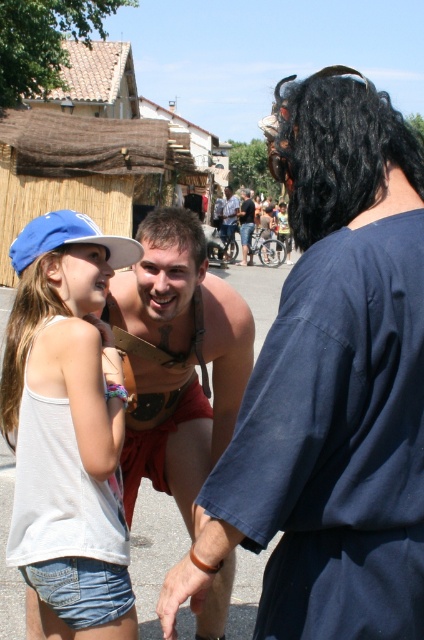
Does shiny black shirt at center have a greater width compared to shiny gold armor at center?

No, shiny black shirt at center is not wider than shiny gold armor at center.

The height and width of the screenshot is (640, 424). I want to click on shiny black shirt at center, so click(x=245, y=225).

At what (x,y) coordinates should I click in order to perform the action: click on shiny black shirt at center. Please return your answer as a coordinate pair (x, y). The height and width of the screenshot is (640, 424). Looking at the image, I should click on (245, 225).

Where is `shiny black shirt at center`? This screenshot has width=424, height=640. shiny black shirt at center is located at coordinates (245, 225).

Which is behind, point (161, 396) or point (78, 211)?

The point (78, 211) is more distant.

Is shiny leather belt at center wider than blue fabric baseball cap at upper left?

Yes.

Is point (186, 298) positioned behind point (78, 237)?

Yes, it is behind point (78, 237).

Where is `shiny leather belt at center`? The image size is (424, 640). shiny leather belt at center is located at coordinates (176, 358).

Which is below, shiny metallic belt at lower left or white denim shorts at lower left?

Positioned lower is white denim shorts at lower left.

Is shiny metallic belt at lower left bigger than white denim shorts at lower left?

No.

At what (x,y) coordinates should I click in order to perform the action: click on shiny metallic belt at lower left. Please return your answer as a coordinate pair (x, y). Image resolution: width=424 pixels, height=640 pixels. Looking at the image, I should click on (331, 387).

Where is `shiny metallic belt at lower left`? The height and width of the screenshot is (640, 424). shiny metallic belt at lower left is located at coordinates (331, 387).